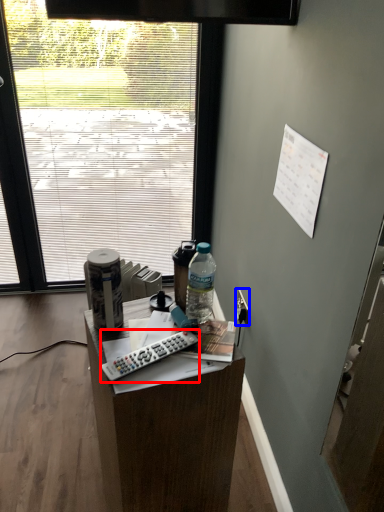
Question: Which object is further to the camera taking this photo, remote control (highlighted by a red box) or power outlet (highlighted by a blue box)?

Choices:
 (A) remote control
 (B) power outlet

Answer: (B)